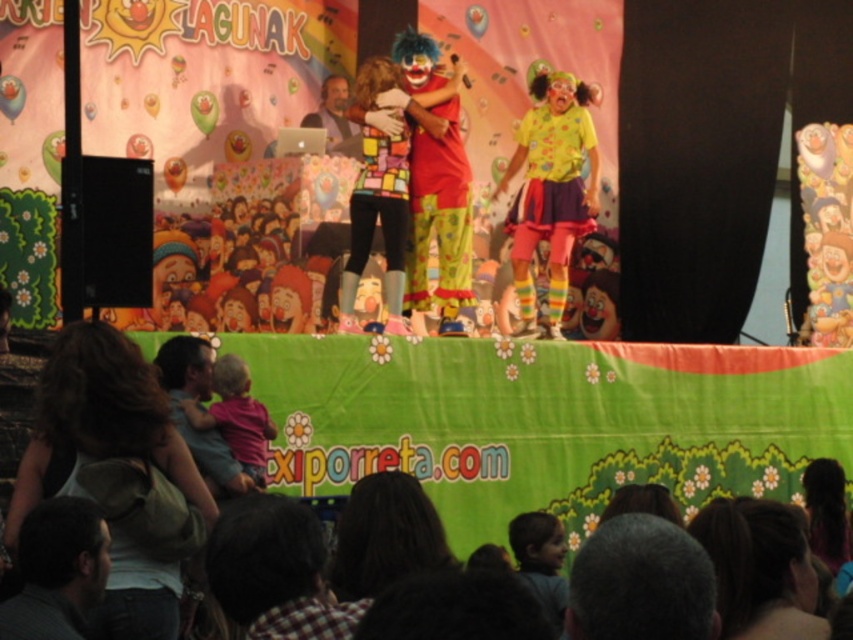
Question: Which point is closer to the camera?

Choices:
 (A) gray fabric shirt at lower left
 (B) matte gray laptop at center
 (C) dark brown hair at lower left
 (D) yellow polka dot shirt at center

Answer: (A)

Question: Which point is farther to the camera?

Choices:
 (A) matte gray laptop at center
 (B) dark brown hair at lower center

Answer: (A)

Question: Does dark brown hair at lower left come in front of gray fabric shirt at lower left?

Choices:
 (A) yes
 (B) no

Answer: (B)

Question: Where is dark brown hair at lower left located in relation to dark brown hair at lower center in the image?

Choices:
 (A) below
 (B) above

Answer: (B)

Question: Is yellow polka dot shirt at center below gray fabric shirt at lower left?

Choices:
 (A) no
 (B) yes

Answer: (A)

Question: Which of the following is the farthest from the observer?

Choices:
 (A) yellow polka dot shirt at center
 (B) matte gray laptop at center
 (C) dark brown hair at lower center

Answer: (B)